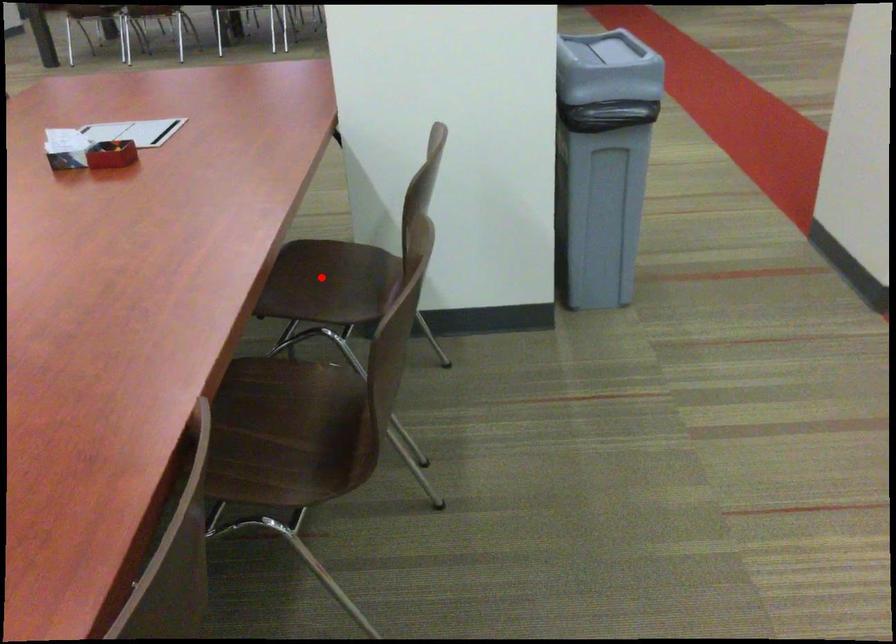
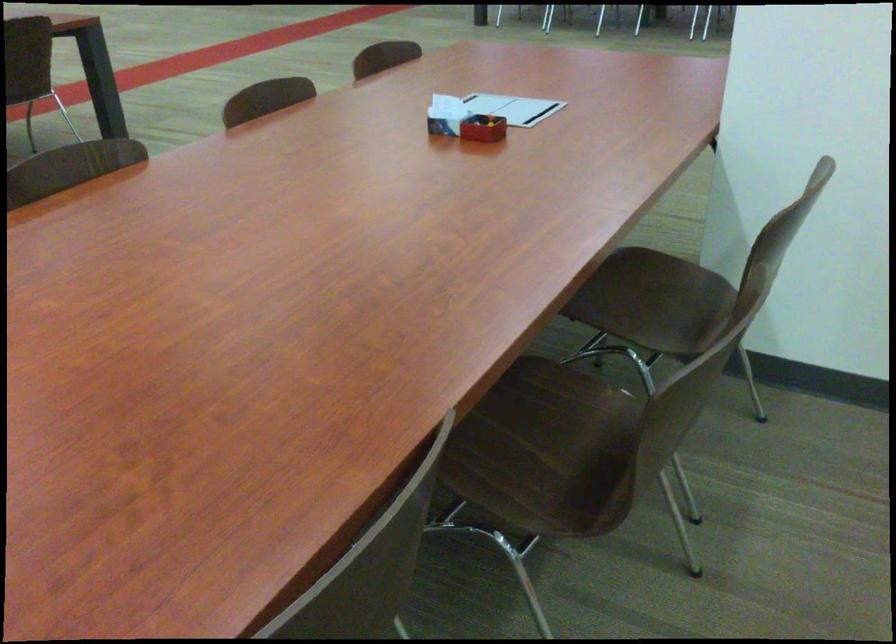
Question: I am providing you with two images of the same scene from different viewpoints. A red point is marked on the first image. Is the red point's position out of view in image 2?

Choices:
 (A) Yes
 (B) No

Answer: (B)